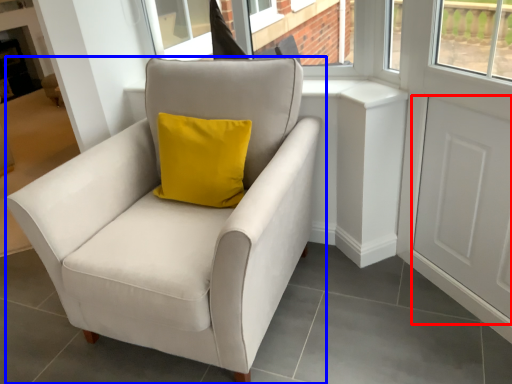
Question: Among these objects, which one is farthest to the camera, screen door (highlighted by a red box) or chair (highlighted by a blue box)?

Choices:
 (A) screen door
 (B) chair

Answer: (A)